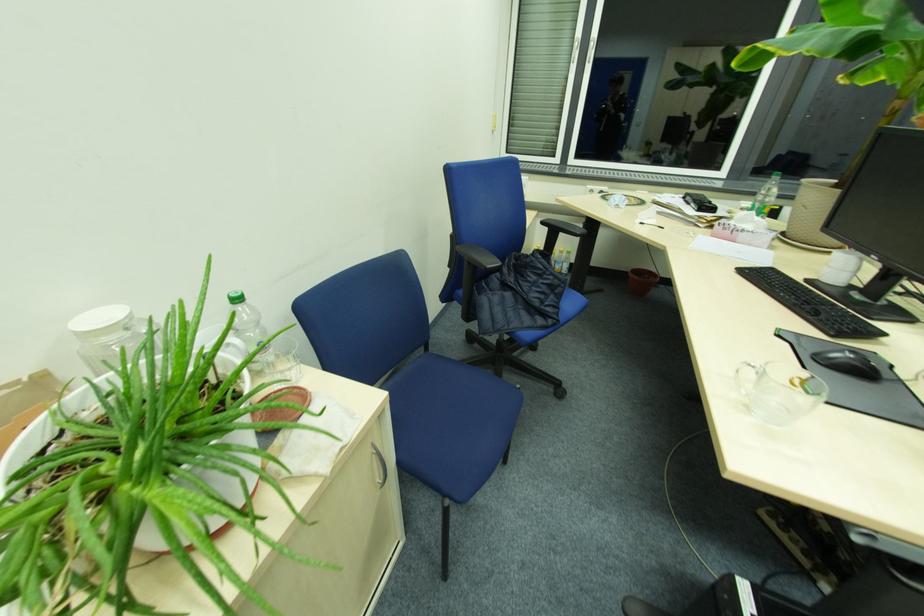
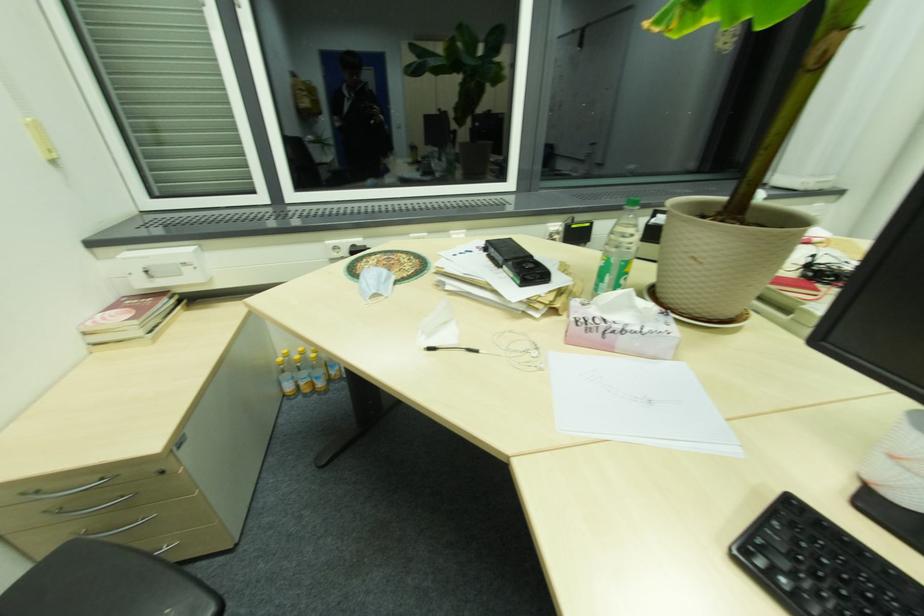
In the second image, find the point that corresponds to pixel 697 235 in the first image.

(540, 355)